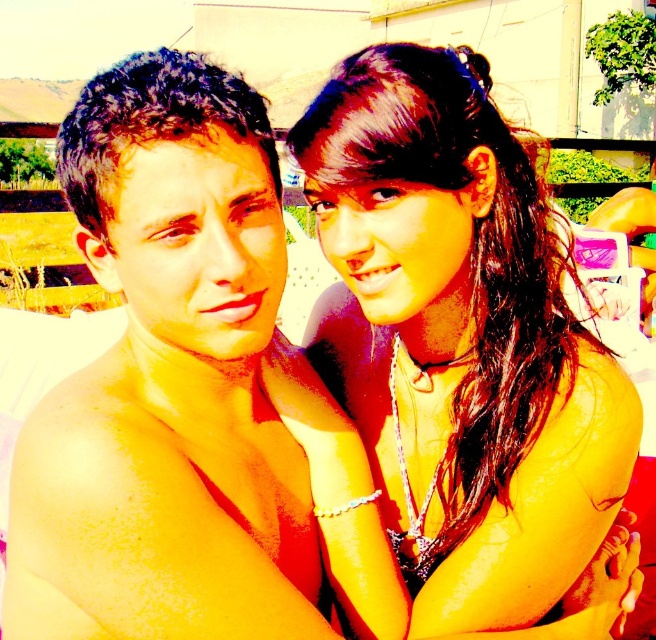
Question: Among these points, which one is nearest to the camera?

Choices:
 (A) (75, 102)
 (B) (415, 586)

Answer: (A)

Question: Is satin black bikini top at upper right wider than shiny skin at left?

Choices:
 (A) yes
 (B) no

Answer: (A)

Question: Can you confirm if satin black bikini top at upper right is bigger than shiny skin at left?

Choices:
 (A) yes
 (B) no

Answer: (A)

Question: Which object appears closest to the camera in this image?

Choices:
 (A) shiny skin at left
 (B) satin black bikini top at upper right

Answer: (A)

Question: In this image, where is satin black bikini top at upper right located relative to shiny skin at left?

Choices:
 (A) below
 (B) above

Answer: (B)